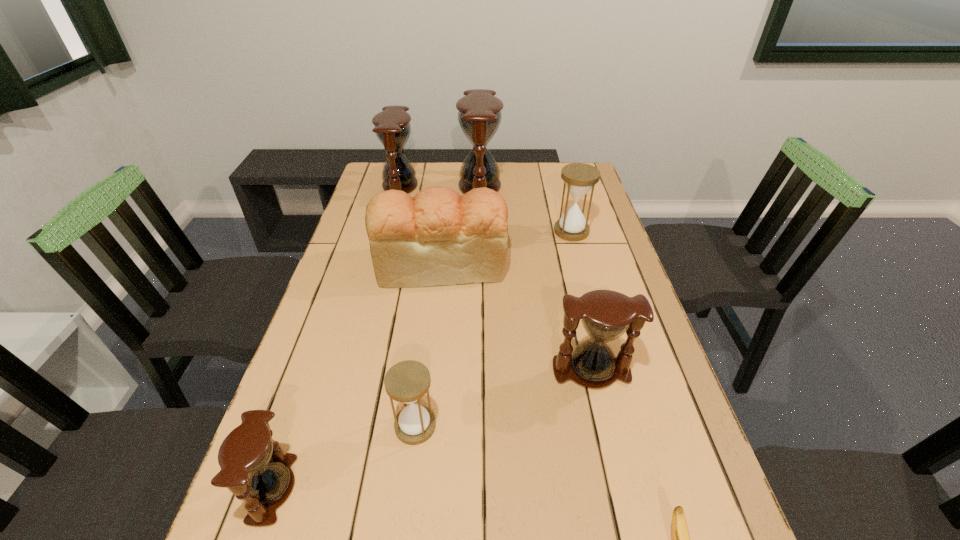
Identify the location of blank region between the nearest brown hourglass and the left white hourglass. The image size is (960, 540). (344, 457).

Where is `free spot between the right white hourglass and the left white hourglass`? The height and width of the screenshot is (540, 960). free spot between the right white hourglass and the left white hourglass is located at coordinates (493, 329).

Select which object is the second closest to the bread. Please provide its 2D coordinates. Your answer should be formatted as a tuple, i.e. [(x, y)], where the tuple contains the x and y coordinates of a point satisfying the conditions above.

[(479, 112)]

Where is `object that is the closest to the second nearest brown hourglass`? object that is the closest to the second nearest brown hourglass is located at coordinates (438, 237).

Select which hourglass appears as the closest to the fifth farthest hourglass. Please provide its 2D coordinates. Your answer should be formatted as a tuple, i.e. [(x, y)], where the tuple contains the x and y coordinates of a point satisfying the conditions above.

[(254, 467)]

Identify which hourglass is the third closest to the smallest brown hourglass. Please provide its 2D coordinates. Your answer should be formatted as a tuple, i.e. [(x, y)], where the tuple contains the x and y coordinates of a point satisfying the conditions above.

[(579, 178)]

In order to click on the second closest brown hourglass relative to the farther white hourglass in this screenshot , I will do `click(606, 315)`.

Select which brown hourglass appears as the closest to the bigger white hourglass. Please provide its 2D coordinates. Your answer should be formatted as a tuple, i.e. [(x, y)], where the tuple contains the x and y coordinates of a point satisfying the conditions above.

[(479, 112)]

You are a GUI agent. You are given a task and a screenshot of the screen. Output one action in this format:
    pyautogui.click(x=<x>, y=<y>)
    Task: Click on the free point that satisfies the following two spatial constraints: 1. on the back side of the nearest hourglass; 2. on the right side of the bread
    This screenshot has width=960, height=540.
    Given the screenshot: What is the action you would take?
    (x=351, y=264)

Identify the location of blank area in the image that satisfies the following two spatial constraints: 1. on the back side of the rightmost brown hourglass; 2. on the right side of the right white hourglass. (559, 231).